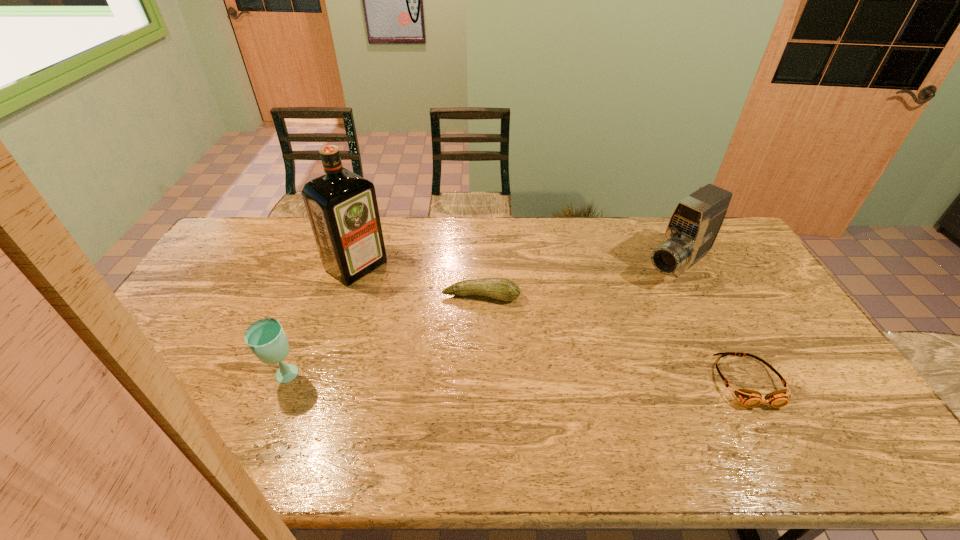
In order to click on vacant space that satisfies the following two spatial constraints: 1. on the back side of the tallest object; 2. on the left side of the third tallest object in this screenshot , I will do `click(327, 266)`.

The width and height of the screenshot is (960, 540). Identify the location of vacant region that satisfies the following two spatial constraints: 1. on the front side of the liquor; 2. on the left side of the fourth tallest object. (347, 297).

Locate an element on the screen. vacant space that satisfies the following two spatial constraints: 1. on the back side of the liquor; 2. on the left side of the glass is located at coordinates (327, 266).